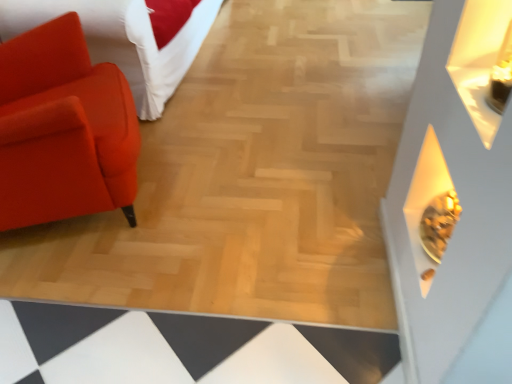
What is the approximate height of matte orange chair at left?

The height of matte orange chair at left is 35.23 inches.

This screenshot has width=512, height=384. What do you see at coordinates (63, 129) in the screenshot?
I see `matte orange chair at left` at bounding box center [63, 129].

The width and height of the screenshot is (512, 384). What are the coordinates of `matte orange chair at left` in the screenshot? It's located at (63, 129).

In order to click on matte orange sofa at left in this screenshot , I will do `click(128, 38)`.

What do you see at coordinates (128, 38) in the screenshot?
I see `matte orange sofa at left` at bounding box center [128, 38].

Find the location of `matte orange chair at left`. matte orange chair at left is located at coordinates (63, 129).

Is matte orange sofa at left at the left side of matte orange chair at left?

Yes, matte orange sofa at left is to the left of matte orange chair at left.

Is matte orange sofa at left behind matte orange chair at left?

Yes.

Which is in front, point (49, 3) or point (103, 150)?

Positioned in front is point (103, 150).

From the image's perspective, which is above, matte orange sofa at left or matte orange chair at left?

matte orange sofa at left, from the image's perspective.

From a real-world perspective, between matte orange sofa at left and matte orange chair at left, who is vertically lower?

From a 3D spatial view, matte orange sofa at left is below.

Considering the sizes of matte orange sofa at left and matte orange chair at left in the image, is matte orange sofa at left wider or thinner than matte orange chair at left?

Clearly, matte orange sofa at left has more width compared to matte orange chair at left.

Which of these two, matte orange sofa at left or matte orange chair at left, stands taller?

matte orange chair at left.

Who is bigger, matte orange sofa at left or matte orange chair at left?

matte orange sofa at left.

Would you say matte orange sofa at left contains matte orange chair at left?

No, matte orange chair at left is located outside of matte orange sofa at left.

Is matte orange sofa at left not close to matte orange chair at left?

matte orange sofa at left is near matte orange chair at left, not far away.

Is matte orange sofa at left positioned with its back to matte orange chair at left?

matte orange sofa at left does not have its back to matte orange chair at left.

Measure the distance from matte orange sofa at left to matte orange chair at left.

matte orange sofa at left is 21.06 inches away from matte orange chair at left.

This screenshot has height=384, width=512. Identify the location of furniture behind the matte orange chair at left. (128, 38).

Which object is positioned more to the right, matte orange chair at left or matte orange sofa at left?

matte orange chair at left is more to the right.

Does matte orange chair at left come in front of matte orange sofa at left?

Yes, the depth of matte orange chair at left is less than that of matte orange sofa at left.

Is point (11, 66) positioned before point (16, 20)?

Yes, it is.

From the image's perspective, which is below, matte orange chair at left or matte orange sofa at left?

matte orange chair at left.

From a real-world perspective, which is physically above, matte orange chair at left or matte orange sofa at left?

matte orange chair at left is physically above.

Can you confirm if matte orange chair at left is wider than matte orange sofa at left?

No, matte orange chair at left is not wider than matte orange sofa at left.

In the scene shown: Is matte orange chair at left taller or shorter than matte orange sofa at left?

matte orange chair at left is taller than matte orange sofa at left.

Does matte orange chair at left have a smaller size compared to matte orange sofa at left?

Correct, matte orange chair at left occupies less space than matte orange sofa at left.

Is matte orange chair at left located outside matte orange sofa at left?

Indeed, matte orange chair at left is completely outside matte orange sofa at left.

Is matte orange chair at left far away from matte orange sofa at left?

No.

Does matte orange chair at left turn towards matte orange sofa at left?

No, matte orange chair at left is not facing towards matte orange sofa at left.

Find the location of a particular element. This screenshot has width=512, height=384. chair on the right of matte orange sofa at left is located at coordinates (63, 129).

This screenshot has height=384, width=512. Find the location of `furniture that is under the matte orange chair at left (from a real-world perspective)`. furniture that is under the matte orange chair at left (from a real-world perspective) is located at coordinates (128, 38).

Locate an element on the screen. This screenshot has width=512, height=384. furniture on the left of matte orange chair at left is located at coordinates (128, 38).